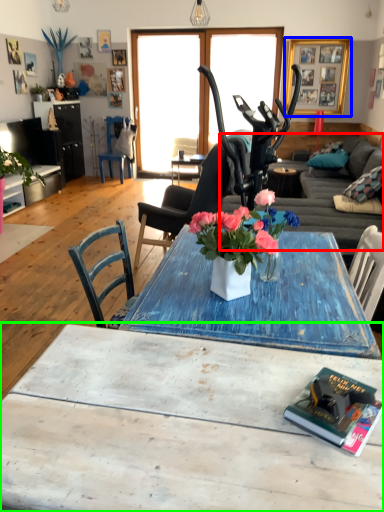
Question: Considering the real-world distances, which object is closest to studio couch (highlighted by a red box)? picture frame (highlighted by a blue box) or coffee table (highlighted by a green box).

Choices:
 (A) picture frame
 (B) coffee table

Answer: (A)